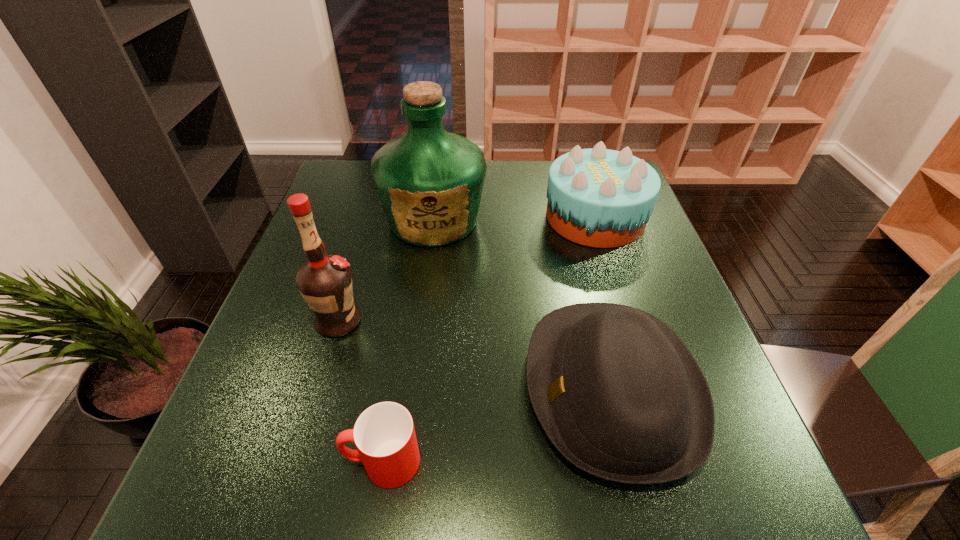
Find the location of a particular element. The height and width of the screenshot is (540, 960). free spot that satisfies the following two spatial constraints: 1. on the side of the cup with the handle; 2. on the left side of the cake is located at coordinates (421, 217).

Find the location of a particular element. The image size is (960, 540). vacant position in the image that satisfies the following two spatial constraints: 1. on the side of the shortest object with the handle; 2. on the back side of the cake is located at coordinates (421, 217).

You are a GUI agent. You are given a task and a screenshot of the screen. Output one action in this format:
    pyautogui.click(x=<x>, y=<y>)
    Task: Click on the vacant position in the image that satisfies the following two spatial constraints: 1. on the front and back of the nearer liquor; 2. on the side of the cup with the handle
    
    Given the screenshot: What is the action you would take?
    pyautogui.click(x=297, y=462)

Find the location of a particular element. The width and height of the screenshot is (960, 540). free space that satisfies the following two spatial constraints: 1. on the front side of the cake; 2. on the front-facing side of the fedora is located at coordinates (649, 388).

This screenshot has width=960, height=540. In order to click on free space that satisfies the following two spatial constraints: 1. on the side of the cup with the handle; 2. on the back side of the cake in this screenshot , I will do `click(421, 217)`.

This screenshot has width=960, height=540. I want to click on free space that satisfies the following two spatial constraints: 1. on the side of the cake with the handle; 2. on the left side of the cup, so click(421, 217).

Find the location of `free space in the image that satisfies the following two spatial constraints: 1. on the front and back of the nearer liquor; 2. on the side of the cup with the handle`. free space in the image that satisfies the following two spatial constraints: 1. on the front and back of the nearer liquor; 2. on the side of the cup with the handle is located at coordinates (297, 462).

Where is `free space that satisfies the following two spatial constraints: 1. on the side of the cup with the handle; 2. on the left side of the cake`? free space that satisfies the following two spatial constraints: 1. on the side of the cup with the handle; 2. on the left side of the cake is located at coordinates (421, 217).